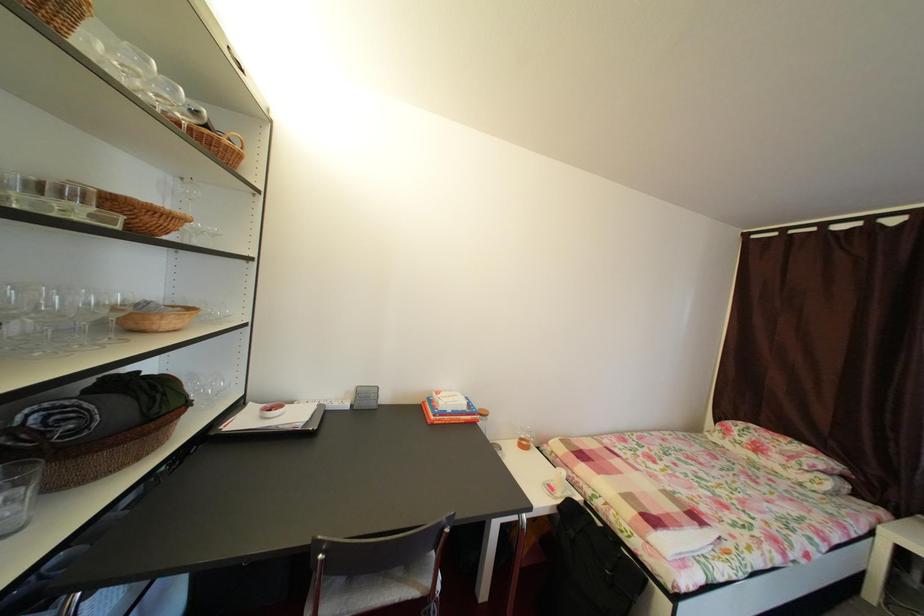
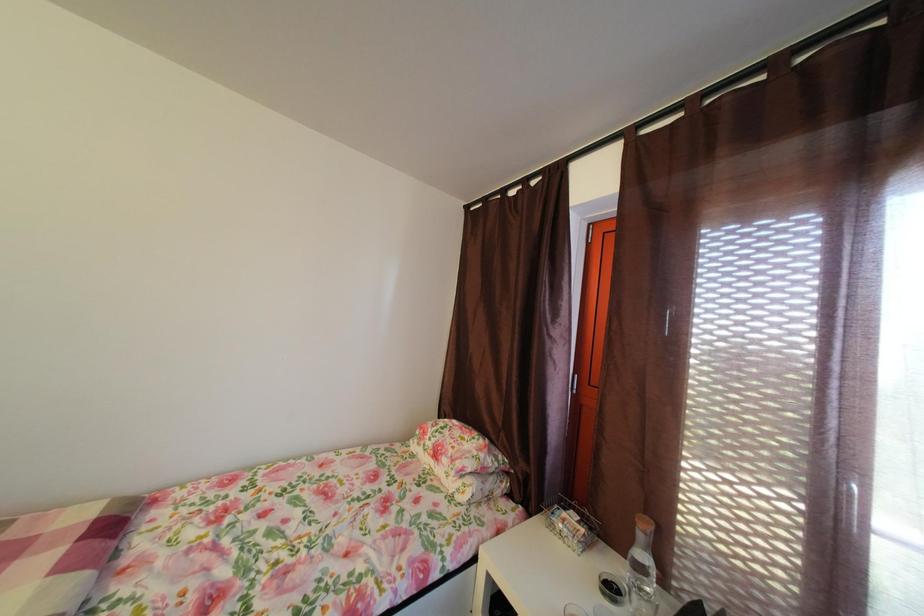
Question: The images are taken continuously from a first-person perspective. In which direction are you moving?

Choices:
 (A) Left
 (B) Right
 (C) Forward
 (D) Backward

Answer: (B)